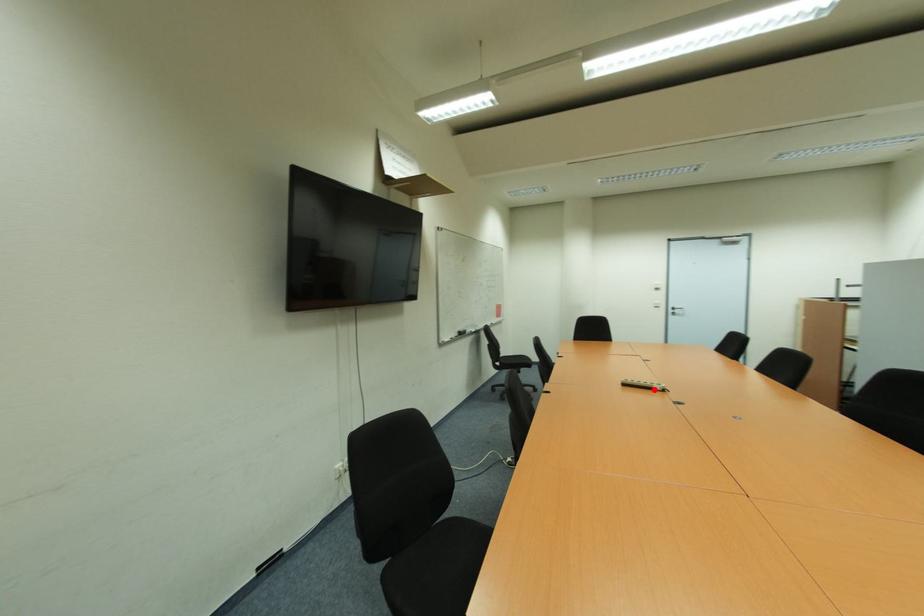
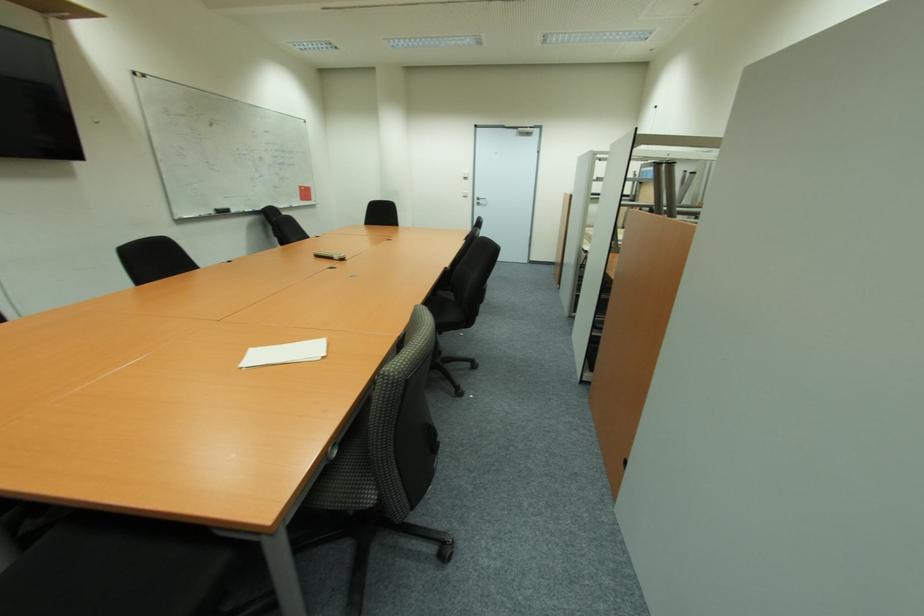
Where in the second image is the point corresponding to the highlighted location from the first image?

(334, 259)